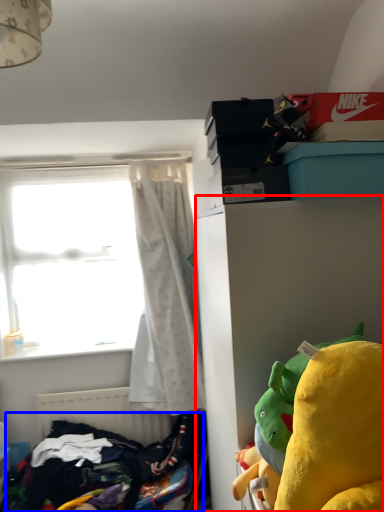
Question: Among these objects, which one is nearest to the camera, cabinetry (highlighted by a red box) or clothing (highlighted by a blue box)?

Choices:
 (A) cabinetry
 (B) clothing

Answer: (A)